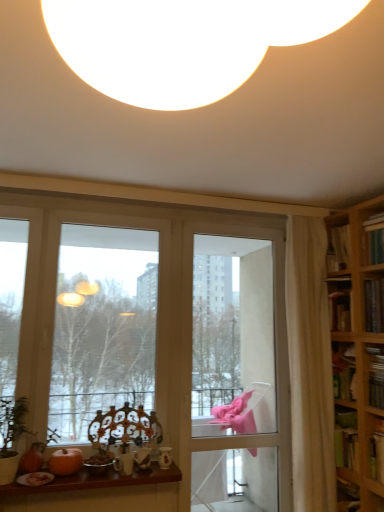
Image resolution: width=384 pixels, height=512 pixels. What are the coordinates of `vacant space situated above white sheer curtain at right (from a real-world perspective)` in the screenshot? It's located at (309, 204).